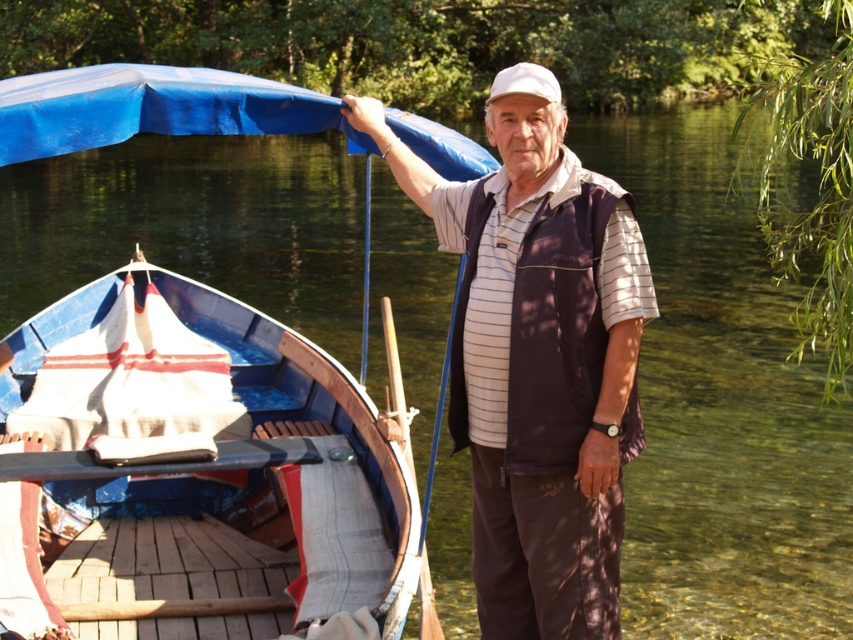
Question: Which point is closer to the camera?

Choices:
 (A) (573, 314)
 (B) (492, 92)

Answer: (A)

Question: Estimate the real-world distances between objects in this image. Which object is farther from the blue painted wood boat at left?

Choices:
 (A) white matte baseball cap at upper center
 (B) brown fabric vest at center

Answer: (A)

Question: Is blue painted wood boat at left above brown fabric vest at center?

Choices:
 (A) no
 (B) yes

Answer: (A)

Question: Can you confirm if blue painted wood boat at left is smaller than brown fabric vest at center?

Choices:
 (A) yes
 (B) no

Answer: (B)

Question: Is blue painted wood boat at left thinner than brown fabric vest at center?

Choices:
 (A) yes
 (B) no

Answer: (B)

Question: Based on their relative distances, which object is farther from the white matte baseball cap at upper center?

Choices:
 (A) brown fabric vest at center
 (B) blue painted wood boat at left

Answer: (B)